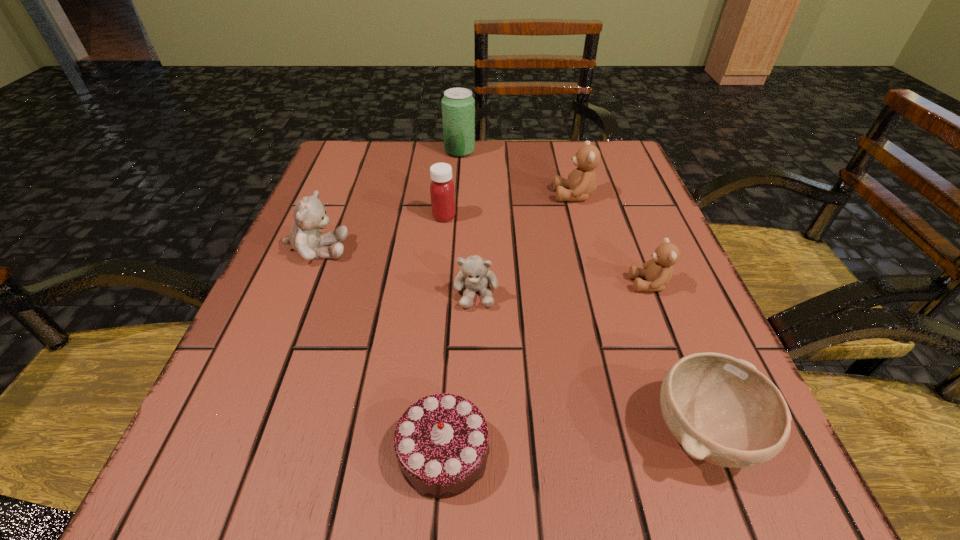
You are a GUI agent. You are given a task and a screenshot of the screen. Output one action in this format:
    pyautogui.click(x=<x>, y=<y>)
    Task: Click on the fourth closest object to the soda
    The height and width of the screenshot is (540, 960).
    Given the screenshot: What is the action you would take?
    pyautogui.click(x=475, y=275)

Identify which object is located as the nearest to the third teddy bear from right to left. Please provide its 2D coordinates. Your answer should be formatted as a tuple, i.e. [(x, y)], where the tuple contains the x and y coordinates of a point satisfying the conditions above.

[(442, 191)]

Locate which teddy bear is the closest to the farthest teddy bear. Please provide its 2D coordinates. Your answer should be formatted as a tuple, i.e. [(x, y)], where the tuple contains the x and y coordinates of a point satisfying the conditions above.

[(657, 271)]

Locate which teddy bear is the closest to the rightmost teddy bear. Please provide its 2D coordinates. Your answer should be formatted as a tuple, i.e. [(x, y)], where the tuple contains the x and y coordinates of a point satisfying the conditions above.

[(581, 182)]

Find the location of a particular element. Image resolution: width=960 pixels, height=540 pixels. free space that satisfies the following two spatial constraints: 1. on the face of the beige bowl; 2. on the left side of the smaller gray teddy bear is located at coordinates (475, 433).

Where is `vacant space that satisfies the following two spatial constraints: 1. on the face of the bowl; 2. on the left side of the second farthest teddy bear`? vacant space that satisfies the following two spatial constraints: 1. on the face of the bowl; 2. on the left side of the second farthest teddy bear is located at coordinates (244, 433).

The width and height of the screenshot is (960, 540). In order to click on vacant region that satisfies the following two spatial constraints: 1. on the face of the beige bowl; 2. on the left side of the smaller gray teddy bear in this screenshot , I will do `click(475, 433)`.

Locate an element on the screen. This screenshot has width=960, height=540. vacant space that satisfies the following two spatial constraints: 1. on the front side of the third farthest object; 2. on the left side of the shortest object is located at coordinates (421, 453).